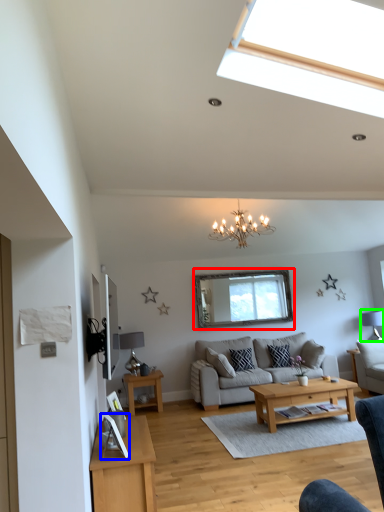
Question: Estimate the real-world distances between objects in this image. Which object is farther from window screen (highlighted by a red box), picture frame (highlighted by a blue box) or lamp (highlighted by a green box)?

Choices:
 (A) picture frame
 (B) lamp

Answer: (A)